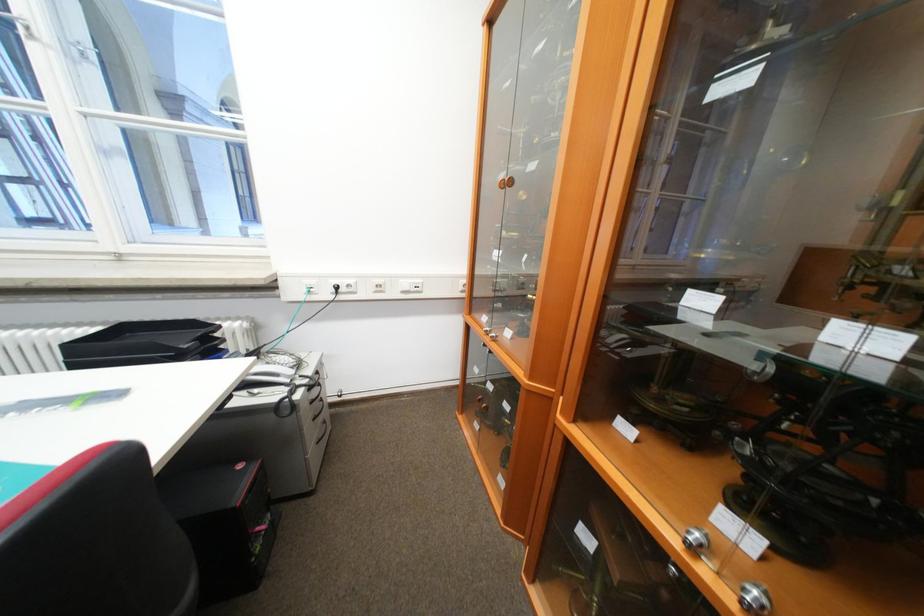
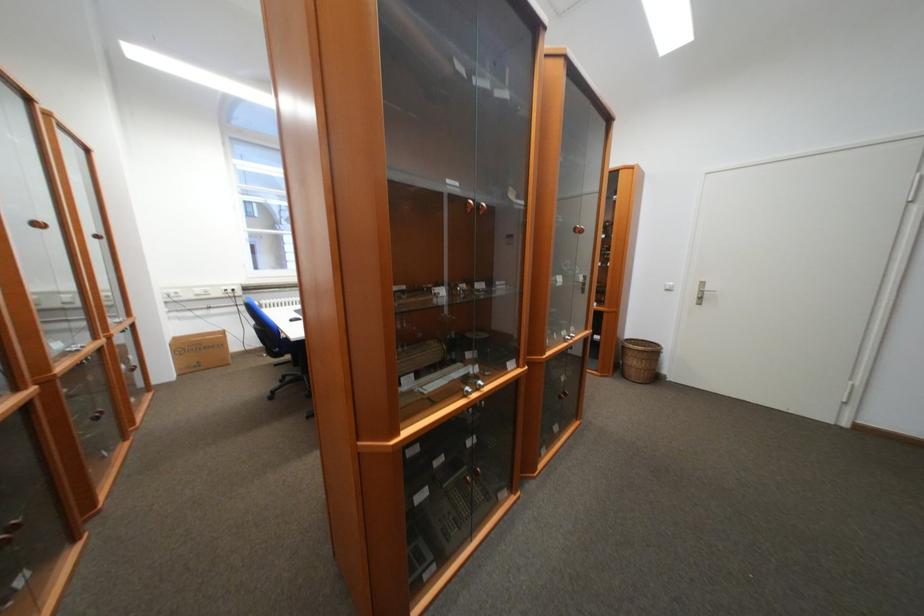
Which direction would the cameraman need to move to produce the second image?

The movement direction of the cameraman is left, backward.